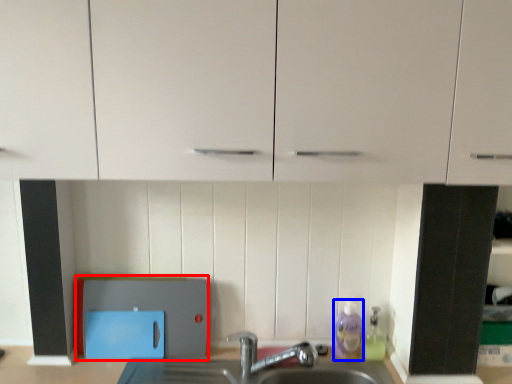
Question: Which object is further to the camera taking this photo, appliance (highlighted by a red box) or cleaning product (highlighted by a blue box)?

Choices:
 (A) appliance
 (B) cleaning product

Answer: (B)